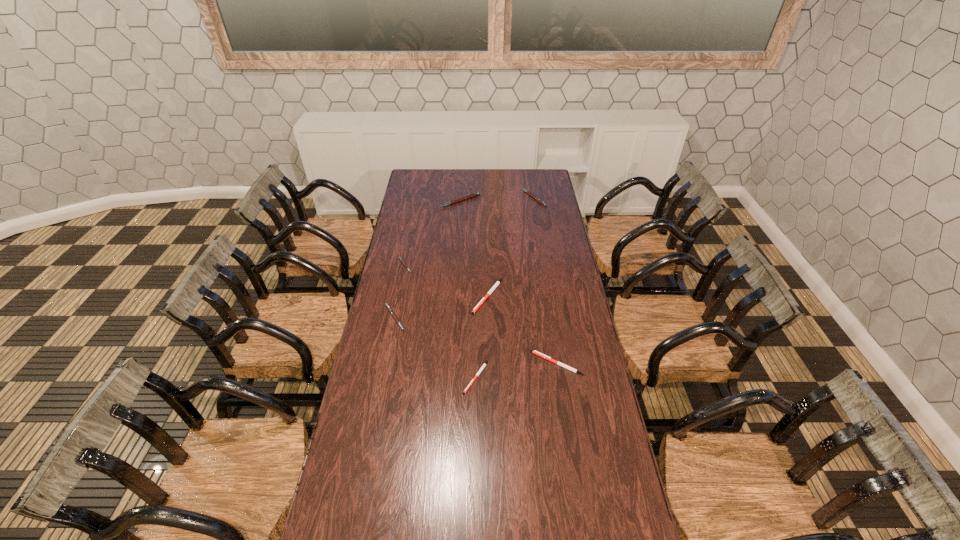
You are a GUI agent. You are given a task and a screenshot of the screen. Output one action in this format:
    pyautogui.click(x=<x>, y=<y>)
    Task: Click on the free spot located at the nib of the rightmost pink pen
    
    Given the screenshot: What is the action you would take?
    pyautogui.click(x=473, y=198)

Image resolution: width=960 pixels, height=540 pixels. Find the location of `blank space located 0.400m at the nib of the rightmost pink pen`. blank space located 0.400m at the nib of the rightmost pink pen is located at coordinates click(455, 198).

Where is `free space located 0.380m at the nib of the rightmost pink pen`? free space located 0.380m at the nib of the rightmost pink pen is located at coordinates (458, 198).

Locate an element on the screen. This screenshot has width=960, height=540. vacant space located on the clicker of the biggest white pen is located at coordinates (489, 333).

At what (x,y) coordinates should I click in order to perform the action: click on vacant position located at the nib of the second smallest pink pen. Please return your answer as a coordinate pair (x, y). Looking at the image, I should click on (433, 318).

This screenshot has width=960, height=540. I want to click on vacant space located on the clicker of the second biggest white pen, so click(456, 363).

At what (x,y) coordinates should I click in order to perform the action: click on blank area located 0.310m on the clicker of the second biggest white pen. Please return your answer as a coordinate pair (x, y). Looking at the image, I should click on (451, 363).

I want to click on free location located 0.220m on the clicker of the second biggest white pen, so click(474, 363).

Image resolution: width=960 pixels, height=540 pixels. Find the location of `vacant space situated at the nib of the smallest pink pen`. vacant space situated at the nib of the smallest pink pen is located at coordinates (473, 266).

Where is `vacant space located 0.300m on the clicker of the smallest white pen`? vacant space located 0.300m on the clicker of the smallest white pen is located at coordinates (475, 479).